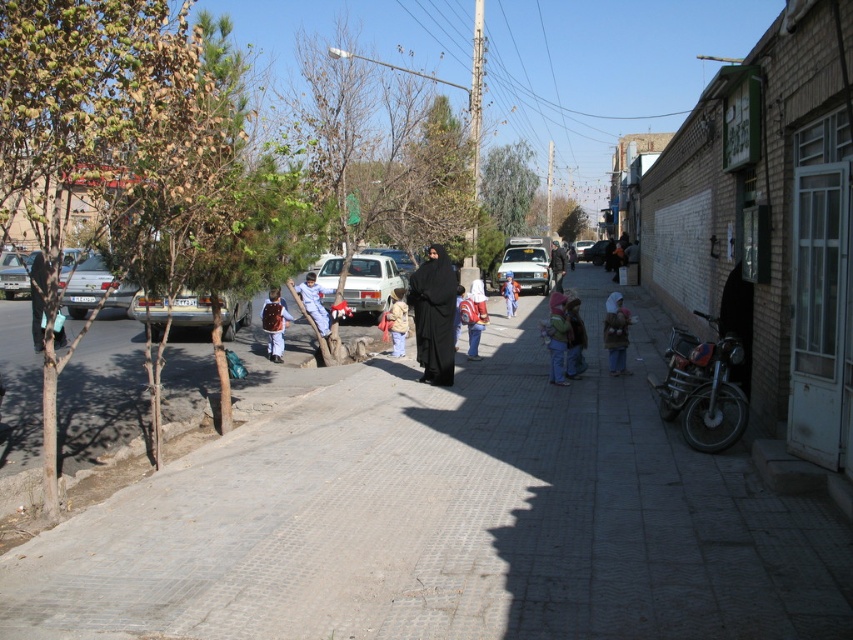
Is point (659, 394) positioned behind point (595, 252)?

That is False.

Which of these two, dark metallic motorcycle at right or metallic silver car at center, stands taller?

metallic silver car at center

The width and height of the screenshot is (853, 640). I want to click on dark metallic motorcycle at right, so click(x=703, y=390).

Is white matte truck at center closer to the viewer compared to blue fabric backpack at center?

No, it is behind blue fabric backpack at center.

Which is more to the left, white matte truck at center or blue fabric backpack at center?

Positioned to the left is blue fabric backpack at center.

Is point (529, 269) farther from camera compared to point (509, 285)?

Yes, point (529, 269) is behind point (509, 285).

Find the location of `white matte truck at center`. white matte truck at center is located at coordinates (525, 266).

Does gray concrete sidewalk at center have a lesser width compared to dark brown leather jacket at left?

Indeed, gray concrete sidewalk at center has a lesser width compared to dark brown leather jacket at left.

Does point (671, 589) come in front of point (32, 285)?

Yes, point (671, 589) is closer to viewer.

You are a GUI agent. You are given a task and a screenshot of the screen. Output one action in this format:
    pyautogui.click(x=<x>, y=<y>)
    Task: Click on the gray concrete sidewalk at center
    
    Given the screenshot: What is the action you would take?
    pyautogui.click(x=448, y=518)